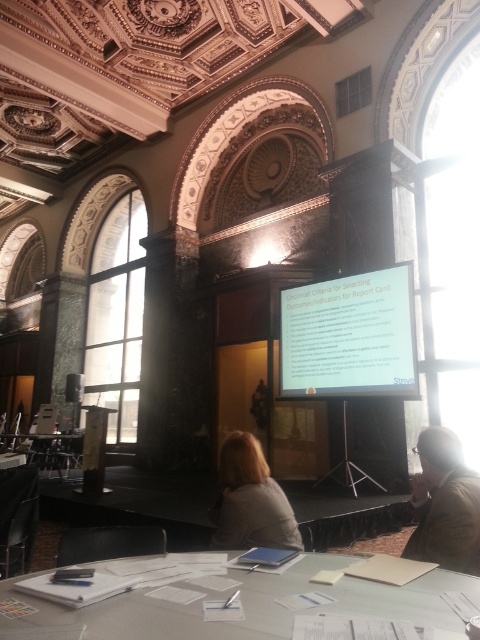
Question: Can you confirm if white glossy table at center is bigger than brown leather jacket at lower right?

Choices:
 (A) no
 (B) yes

Answer: (B)

Question: Does brown leather jacket at lower right appear on the left side of gray fabric jacket at center?

Choices:
 (A) no
 (B) yes

Answer: (A)

Question: Which is nearer to the gray fabric jacket at center?

Choices:
 (A) white matte projector screen at center
 (B) white glossy table at center

Answer: (B)

Question: Does brown leather jacket at lower right have a lesser width compared to gray fabric jacket at center?

Choices:
 (A) no
 (B) yes

Answer: (B)

Question: Among these objects, which one is nearest to the camera?

Choices:
 (A) gray fabric jacket at center
 (B) white glossy table at center

Answer: (B)

Question: Which of the following is the farthest from the observer?

Choices:
 (A) brown leather jacket at lower right
 (B) white matte projector screen at center
 (C) white glossy table at center

Answer: (B)